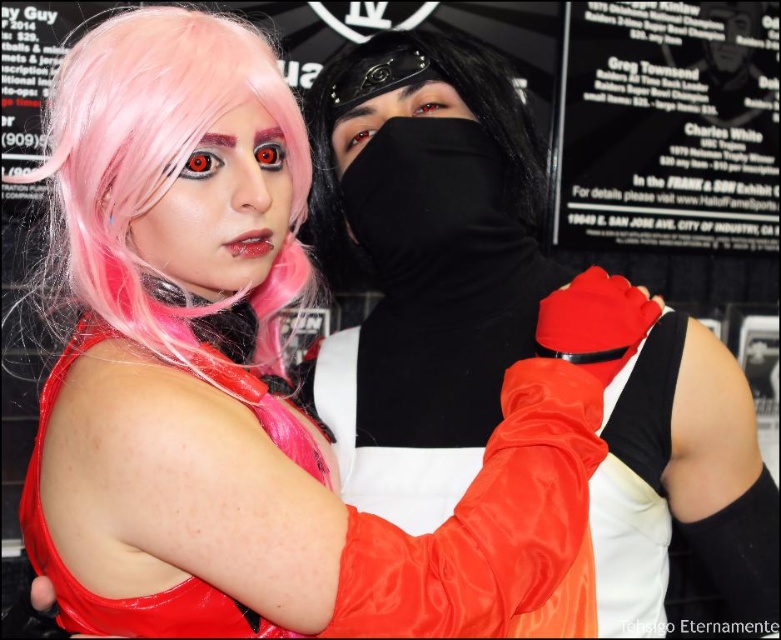
Question: Is shiny satin gloves at upper right to the right of shiny pink wig at center from the viewer's perspective?

Choices:
 (A) no
 (B) yes

Answer: (B)

Question: Among these objects, which one is farthest from the camera?

Choices:
 (A) pink silky wig at upper left
 (B) black matte mask at center
 (C) shiny satin gloves at upper right
 (D) matte black mask at center

Answer: (B)

Question: Which of these objects is positioned farthest from the shiny pink wig at center?

Choices:
 (A) shiny satin gloves at upper right
 (B) pink silky wig at upper left

Answer: (A)

Question: Considering the relative positions of shiny pink wig at center and black matte mask at center in the image provided, where is shiny pink wig at center located with respect to black matte mask at center?

Choices:
 (A) below
 (B) above

Answer: (A)

Question: From the image, what is the correct spatial relationship of pink silky wig at upper left in relation to shiny pink wig at center?

Choices:
 (A) left
 (B) right

Answer: (A)

Question: Among these points, which one is nearest to the camera?

Choices:
 (A) (690, 513)
 (B) (391, 93)

Answer: (A)